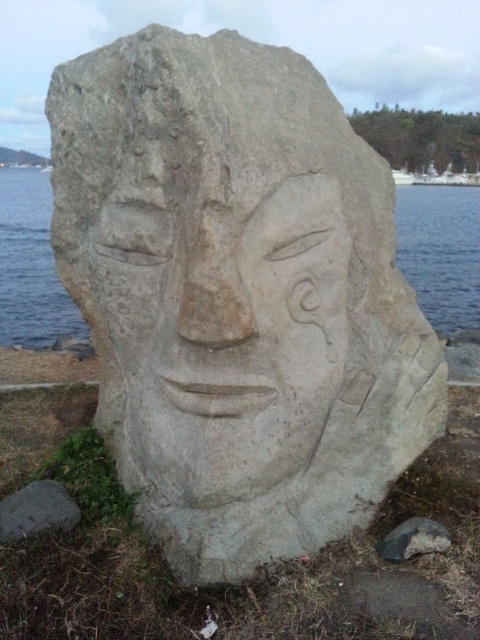
Which is in front, point (68, 529) or point (412, 516)?

Positioned in front is point (68, 529).

How much distance is there between gray rough rock at lower left and gray stone carving at lower right?

4.72 feet

Which is in front, point (13, 536) or point (412, 529)?

Positioned in front is point (13, 536).

Find the location of `gray rough rock at lower left`. gray rough rock at lower left is located at coordinates (36, 509).

Does clear water at lower left have a smaller size compared to gray stone carving at lower right?

Incorrect, clear water at lower left is not smaller in size than gray stone carving at lower right.

The image size is (480, 640). I want to click on clear water at lower left, so click(x=441, y=252).

Locate an element on the screen. clear water at lower left is located at coordinates (441, 252).

Between white stone face at center and gray rough rock at lower left, which one is positioned higher?

Positioned higher is white stone face at center.

Can you confirm if white stone face at center is positioned below gray rough rock at lower left?

Incorrect, white stone face at center is not positioned below gray rough rock at lower left.

Does point (286, 186) lie in front of point (39, 518)?

Yes, it is.

Identify the location of white stone face at center. Image resolution: width=480 pixels, height=640 pixels. (224, 333).